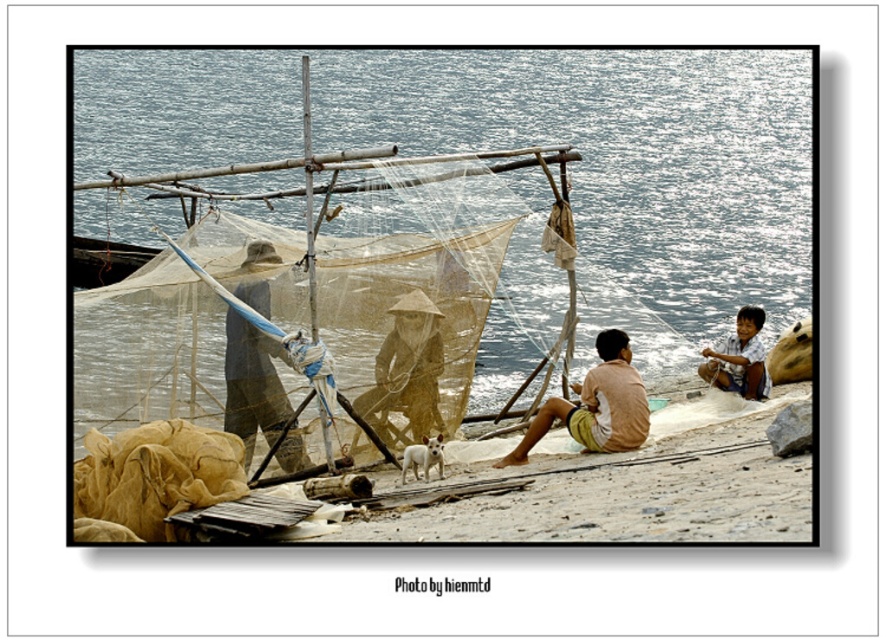
What is located at the coordinates point [595,404] in the coastal scene?

The point [595,404] marks light brown woven shorts at center.

You are a tourist visiting the beach and want to take a photo of the matte blue fishing net at center and the light brown wooden stick at lower right. Can you see both objects clearly in the same photo without any obstruction?

Yes, the matte blue fishing net at center is in front of the light brown wooden stick at lower right, so both can be seen clearly in the same photo without obstruction.